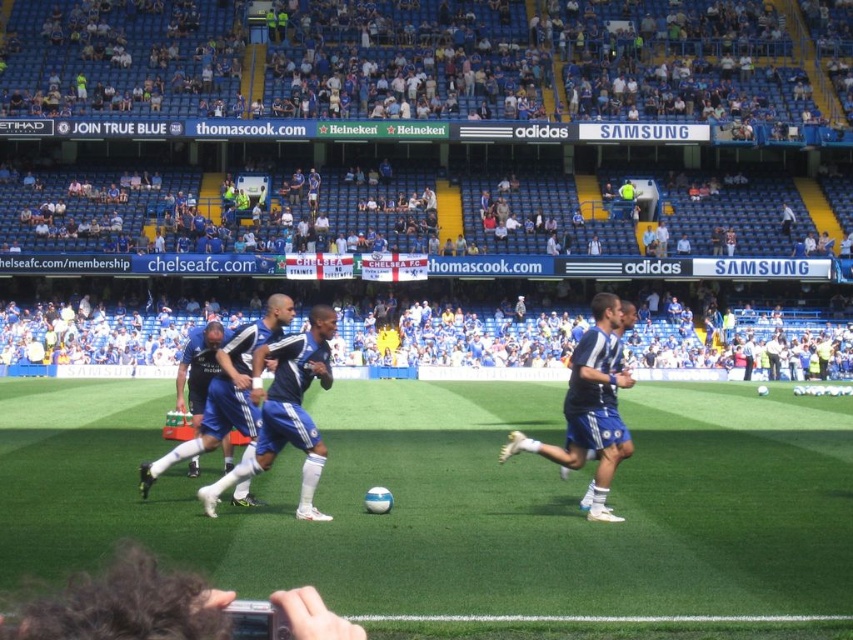
Does point (567, 540) come closer to viewer compared to point (590, 328)?

Yes, point (567, 540) is closer to viewer.

The height and width of the screenshot is (640, 853). Describe the element at coordinates (459, 500) in the screenshot. I see `green artificial turf at center` at that location.

Identify the location of green artificial turf at center. (459, 500).

Which is more to the left, green artificial turf at center or blue fabric jersey at center?

blue fabric jersey at center is more to the left.

Is green artificial turf at center positioned at the back of blue fabric jersey at center?

No, green artificial turf at center is closer to the viewer.

Who is more forward, (576, 593) or (282, 412)?

Point (576, 593) is more forward.

Where is `green artificial turf at center`? The width and height of the screenshot is (853, 640). green artificial turf at center is located at coordinates (459, 500).

Measure the distance between blue fabric jersey at center and camera.

blue fabric jersey at center is 12.28 meters from camera.

Is blue fabric jersey at center above blue fabric shorts at right?

Incorrect, blue fabric jersey at center is not positioned above blue fabric shorts at right.

At what (x,y) coordinates should I click in order to perform the action: click on blue fabric jersey at center. Please return your answer as a coordinate pair (x, y). This screenshot has width=853, height=640. Looking at the image, I should click on (248, 394).